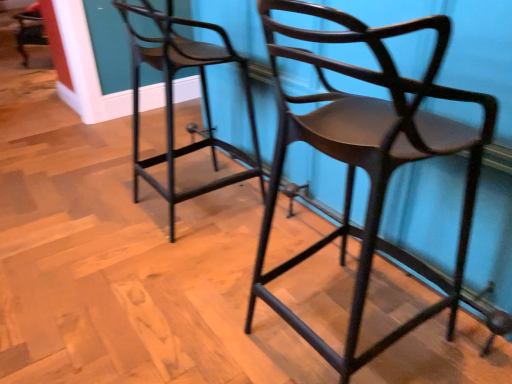
Find the location of a particular element. This screenshot has height=384, width=512. free space to the left of matte black stool at center, positioned as the 1th chair in left-to-right order is located at coordinates coord(105,198).